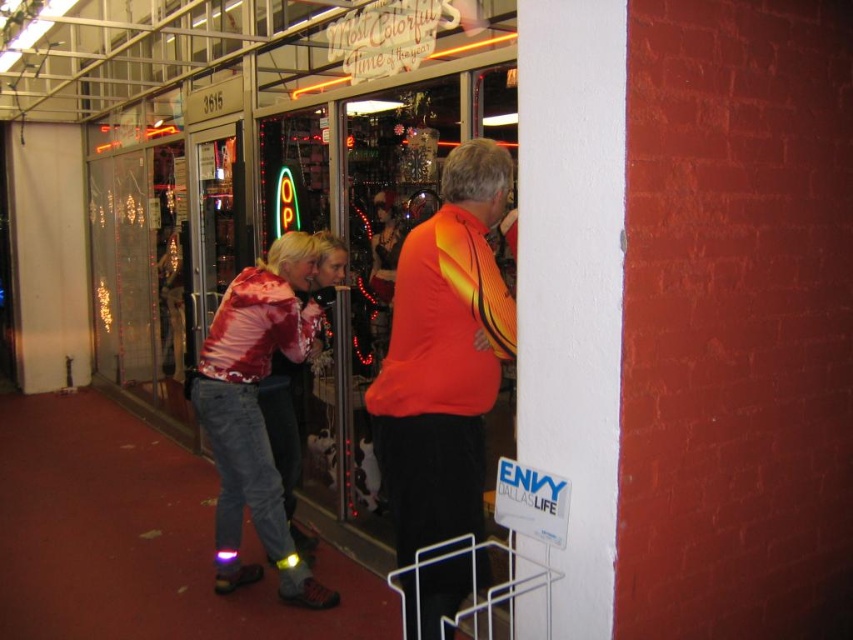
Based on the photo, you are a customer looking through the window of the store. You see an orange jersey at center and a shiny red jacket at center. Which item is shorter in height?

The orange jersey at center has a lesser height compared to the shiny red jacket at center, so the orange jersey at center is shorter in height.

Consider the image. You are a customer entering the store through the glass doors. You see an orange jersey at center and a shiny red jacket at center. Which clothing item is closer to you as you enter the store?

The orange jersey at center is closer to you because it is in front of the shiny red jacket at center.

You are a customer standing outside the store looking through the glass doors. You see an orange jersey at center and a shiny red jacket at center. Which item is located to the right of the other?

The orange jersey at center is positioned on the right side of shiny red jacket at center, so the orange jersey at center is to the right of the shiny red jacket at center.